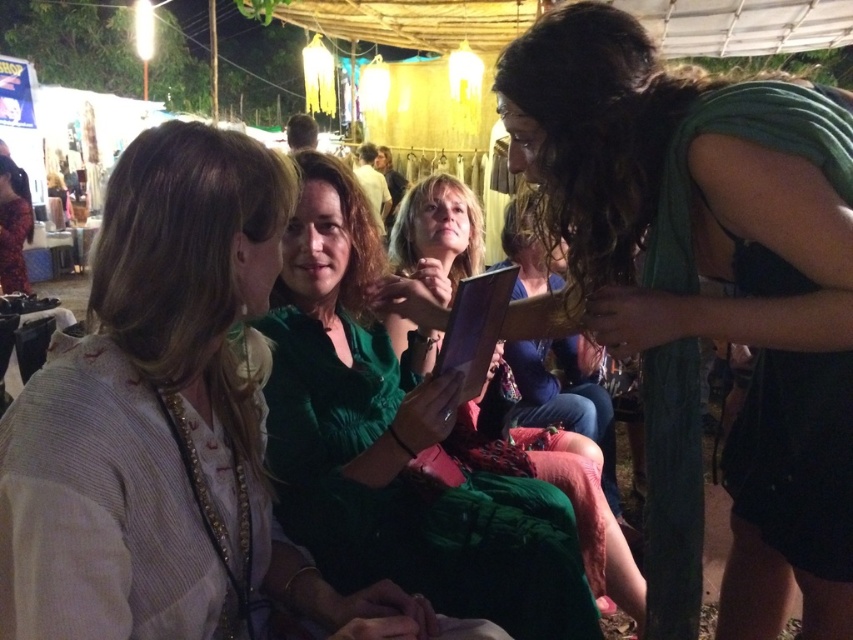
You are at the lively nighttime gathering and want to know which of the two points, point (90, 595) or point (413, 536), is closer to you. Can you determine this based on the scene?

Point (90, 595) is closer to the viewer than point (413, 536).

You are organizing a fashion show and need to decide the order of the models. The green fabric scarf at center and the green satin dress at center are both part of the collection. Which item should be displayed first if you want to showcase the thinner items before the thicker ones?

The green fabric scarf at center should be displayed first because it is thinner than the green satin dress at center.